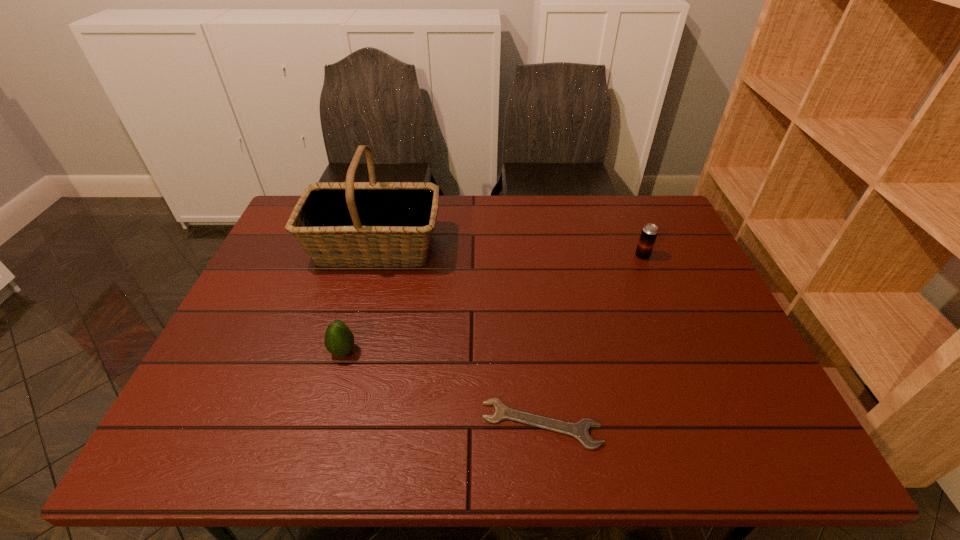
Locate an element on the screen. object at the near edge is located at coordinates (580, 430).

Find the location of a particular element. The height and width of the screenshot is (540, 960). object present at the left edge is located at coordinates (338, 224).

The height and width of the screenshot is (540, 960). In order to click on object situated at the right edge in this screenshot , I will do `click(649, 232)`.

Find the location of a particular element. Image resolution: width=960 pixels, height=540 pixels. object present at the far left corner is located at coordinates (338, 224).

Where is `free spot at the far edge of the desktop`? The width and height of the screenshot is (960, 540). free spot at the far edge of the desktop is located at coordinates (481, 214).

I want to click on free space at the near edge of the desktop, so tap(414, 427).

In the image, there is a desktop. Where is `vacant space at the left edge`? vacant space at the left edge is located at coordinates (287, 245).

Find the location of `vacant space at the right edge`. vacant space at the right edge is located at coordinates (684, 297).

You are a GUI agent. You are given a task and a screenshot of the screen. Output one action in this format:
    pyautogui.click(x=<x>, y=<y>)
    Task: Click on the free location at the far right corner of the desktop
    
    Given the screenshot: What is the action you would take?
    pyautogui.click(x=670, y=238)

You are a GUI agent. You are given a task and a screenshot of the screen. Output one action in this format:
    pyautogui.click(x=<x>, y=<y>)
    Task: Click on the vacant space at the near right corner
    This screenshot has width=960, height=540.
    Given the screenshot: What is the action you would take?
    pyautogui.click(x=749, y=441)